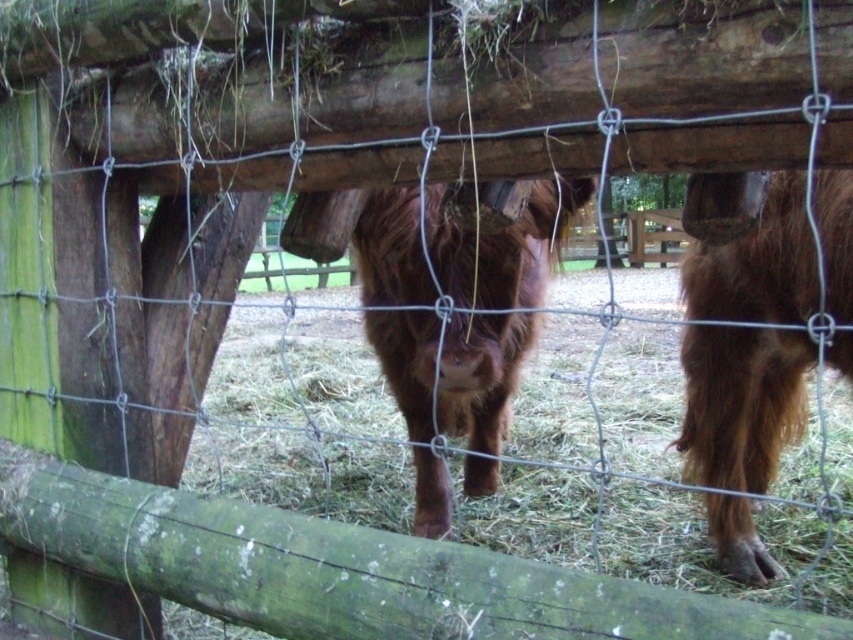
You are a farmer checking on your cows. You see the brown fuzzy cow at right and the brown fuzzy cow at center. Which cow is closer to you?

The brown fuzzy cow at right is closer to the viewer than the brown fuzzy cow at center.

You are a farmer who wants to separate the two brown fuzzy cows using the wire fence. Since the brown fuzzy cow at right is to the right of the brown fuzzy cow at center, which cow should you move to the left to keep them apart?

You should move the brown fuzzy cow at right to the left side of the brown fuzzy cow at center so they are separated by the wire fence.

In the scene shown: You are standing at the center of the enclosure, looking towards the wire fence in the foreground. There is a point marked at coordinates (741, 403). Which animal does this point correspond to?

The point at (741, 403) corresponds to the brown fuzzy cow at right.